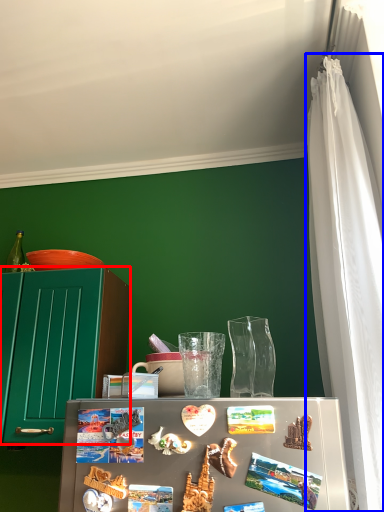
Question: Which of the following is the closest to the observer, cabinetry (highlighted by a red box) or curtain (highlighted by a blue box)?

Choices:
 (A) cabinetry
 (B) curtain

Answer: (B)